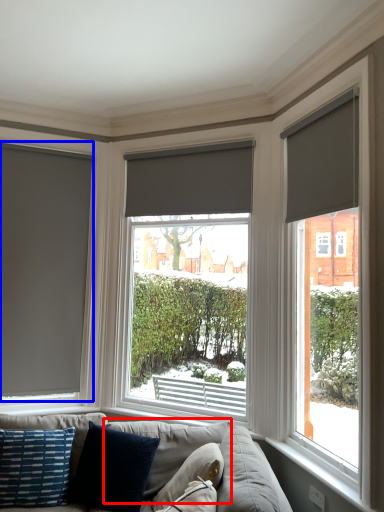
Question: Which point is closer to the camera, pillow (highlighted by a red box) or window (highlighted by a blue box)?

Choices:
 (A) pillow
 (B) window

Answer: (A)